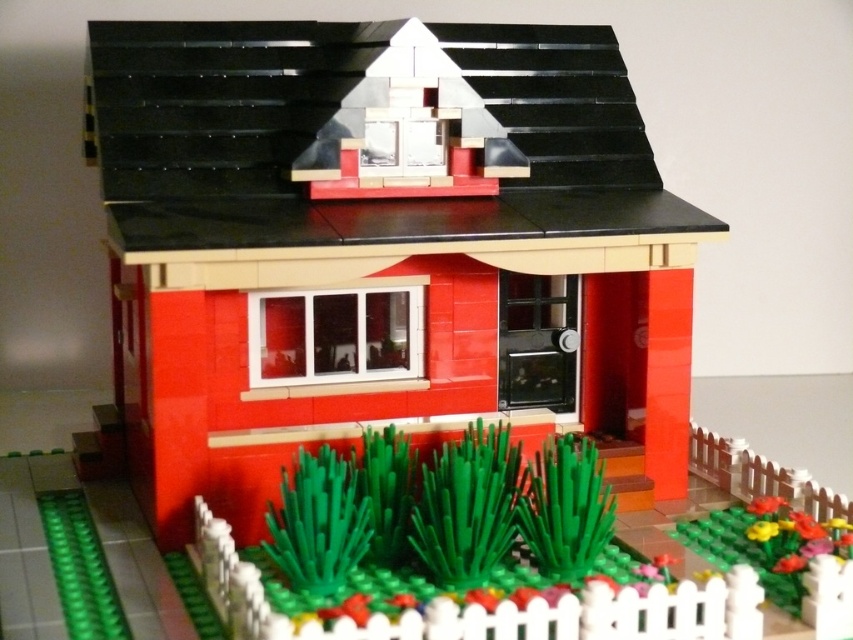
You are designing a miniature garden and need to place both the brick house at center and the floral plastic flowers at lower right. Given their sizes, which object should be placed first to ensure proper spacing?

The brick house at center should be placed first because its width is larger than the floral plastic flowers at lower right, ensuring there is enough space for both in the miniature garden.

You are standing in front of the LEGO model and want to place a new LEGO tree exactly 0.5 meters to the right of the brick house at center. Where should you place it?

The brick house at center is located at point [373,244]. To place the tree 0.5 meters to the right, you would position it at coordinates [373,564].

You are a visitor approaching the brick house at center and the floral plastic flowers at lower right. Which object would you encounter first as you walk towards the house?

The floral plastic flowers at lower right would be encountered first because they are positioned below the brick house at center, meaning they are closer to the viewer.